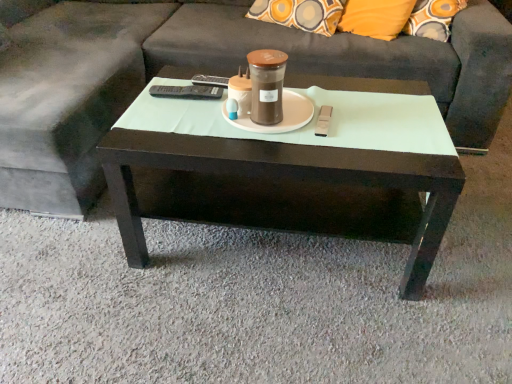
Question: Is brown matte jar at center at the back of dark wood coffee table at center?

Choices:
 (A) yes
 (B) no

Answer: (B)

Question: From a real-world perspective, is dark wood coffee table at center located higher than brown matte jar at center?

Choices:
 (A) yes
 (B) no

Answer: (B)

Question: From the image's perspective, is dark wood coffee table at center above brown matte jar at center?

Choices:
 (A) yes
 (B) no

Answer: (B)

Question: Is dark wood coffee table at center smaller than brown matte jar at center?

Choices:
 (A) yes
 (B) no

Answer: (B)

Question: Is dark wood coffee table at center thinner than brown matte jar at center?

Choices:
 (A) yes
 (B) no

Answer: (B)

Question: From the image's perspective, would you say dark wood coffee table at center is shown under brown matte jar at center?

Choices:
 (A) yes
 (B) no

Answer: (A)

Question: Considering the relative sizes of white matte saucer at center and dark wood coffee table at center in the image provided, is white matte saucer at center shorter than dark wood coffee table at center?

Choices:
 (A) no
 (B) yes

Answer: (B)

Question: Can you confirm if white matte saucer at center is thinner than dark wood coffee table at center?

Choices:
 (A) no
 (B) yes

Answer: (B)

Question: Is white matte saucer at center at the right side of dark wood coffee table at center?

Choices:
 (A) yes
 (B) no

Answer: (B)

Question: From the image's perspective, is white matte saucer at center beneath dark wood coffee table at center?

Choices:
 (A) yes
 (B) no

Answer: (B)

Question: From the image's perspective, is white matte saucer at center above dark wood coffee table at center?

Choices:
 (A) yes
 (B) no

Answer: (A)

Question: Could you tell me if white matte saucer at center is turned towards dark wood coffee table at center?

Choices:
 (A) yes
 (B) no

Answer: (B)

Question: Can you confirm if dark gray fabric couch at center is bigger than dark wood coffee table at center?

Choices:
 (A) no
 (B) yes

Answer: (B)